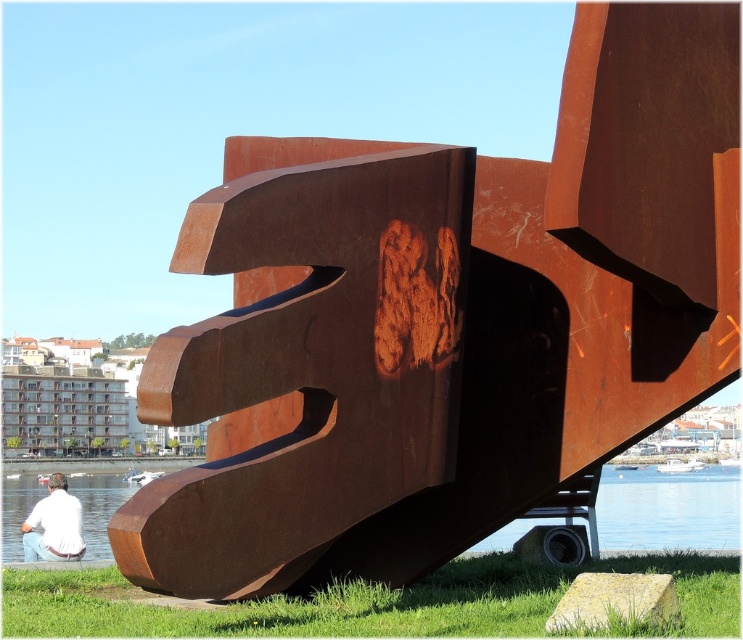
Is point (606, 520) behind point (51, 484)?

That is True.

Does clear blue water at lower center have a larger size compared to white shirt at lower left?

Indeed, clear blue water at lower center has a larger size compared to white shirt at lower left.

Is point (704, 525) farther from viewer compared to point (58, 525)?

Yes.

The height and width of the screenshot is (640, 743). In order to click on clear blue water at lower center in this screenshot , I will do `click(668, 509)`.

Describe the element at coordinates (366, 602) in the screenshot. The width and height of the screenshot is (743, 640). I see `green grass at lower center` at that location.

Can you confirm if green grass at lower center is positioned to the left of clear blue water at lower center?

Indeed, green grass at lower center is positioned on the left side of clear blue water at lower center.

Where is `green grass at lower center`? Image resolution: width=743 pixels, height=640 pixels. green grass at lower center is located at coordinates (366, 602).

Measure the distance between point (97, 600) and camera.

Point (97, 600) is 47.95 meters from camera.

In the scene shown: Is green grass at lower center further to camera compared to white shirt at lower left?

No, it is not.

Locate an element on the screen. This screenshot has height=640, width=743. green grass at lower center is located at coordinates (366, 602).